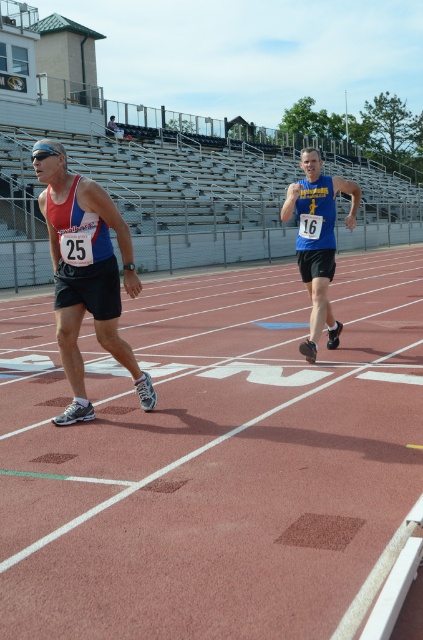
Question: Does matte blue tank top at left appear on the left side of blue jersey at center?

Choices:
 (A) yes
 (B) no

Answer: (A)

Question: Is matte blue tank top at left to the left of blue jersey at center from the viewer's perspective?

Choices:
 (A) no
 (B) yes

Answer: (B)

Question: Considering the real-world distances, which object is farthest from the blue jersey at center?

Choices:
 (A) matte blue tank top at left
 (B) rubberized track at center

Answer: (A)

Question: Which of these objects is positioned farthest from the matte blue tank top at left?

Choices:
 (A) rubberized track at center
 (B) blue jersey at center

Answer: (B)

Question: Can you confirm if rubberized track at center is bigger than matte blue tank top at left?

Choices:
 (A) no
 (B) yes

Answer: (B)

Question: Which of the following is the closest to the observer?

Choices:
 (A) blue jersey at center
 (B) rubberized track at center

Answer: (B)